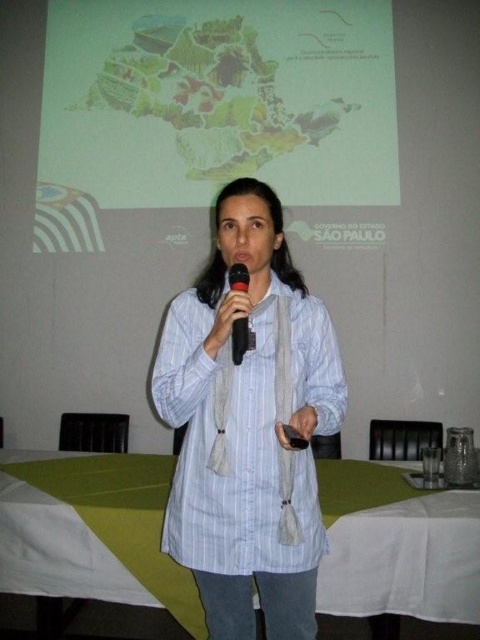
You are an attendee at this presentation and need to refer to the map displayed on the screen. Which object is positioned higher up between the matte plastic map at upper center and the black plastic microphone at center?

The matte plastic map at upper center is located above the black plastic microphone at center, so the matte plastic map at upper center is positioned higher up.

You are standing in the room where the presentation is happening. You want to reach the matte plastic map at upper center to adjust its position. Considering your height is 5 feet 6 inches, can you comfortably reach it without needing a stool?

The matte plastic map at upper center is 12.29 feet away from the viewer. Since the distance is quite far, you would need to move closer or use a device to reach it, as 12.29 feet is beyond comfortable arm reach for someone who is 5 feet 6 inches tall.